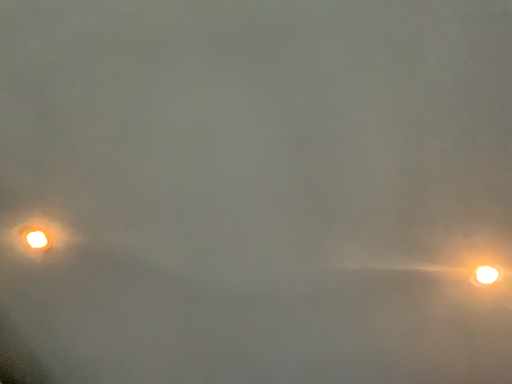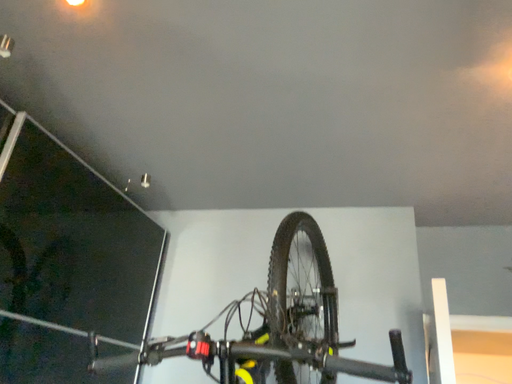
Question: How did the camera likely rotate when shooting the video?

Choices:
 (A) rotated downward
 (B) rotated upward

Answer: (A)